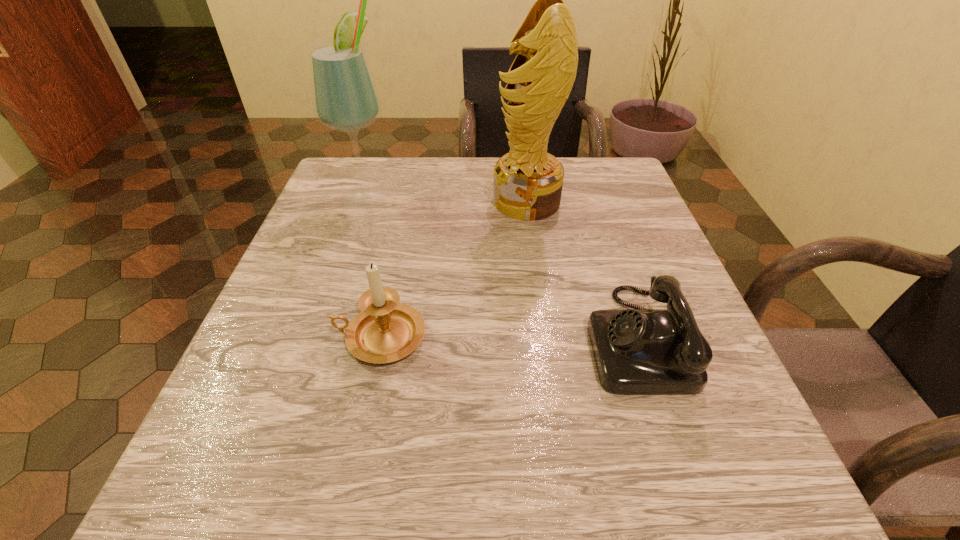
Identify the location of vacant space at the far edge. The image size is (960, 540). (444, 176).

Image resolution: width=960 pixels, height=540 pixels. In the image, there is a desktop. Identify the location of vacant space at the near edge. (443, 491).

At what (x,y) coordinates should I click in order to perform the action: click on free space at the left edge of the desktop. Please return your answer as a coordinate pair (x, y). The height and width of the screenshot is (540, 960). Looking at the image, I should click on (319, 299).

Locate an element on the screen. The height and width of the screenshot is (540, 960). vacant space at the right edge of the desktop is located at coordinates (761, 437).

Identify the location of blank space at the near left corner of the desktop. This screenshot has height=540, width=960. (270, 471).

The width and height of the screenshot is (960, 540). I want to click on free space at the far right corner of the desktop, so click(x=622, y=177).

Locate an element on the screen. This screenshot has width=960, height=540. free spot between the telephone and the award is located at coordinates (581, 270).

Locate an element on the screen. The height and width of the screenshot is (540, 960). unoccupied area between the candle holder and the award is located at coordinates (453, 269).

This screenshot has height=540, width=960. What are the coordinates of `unoccupied position between the candle holder and the shortest object` in the screenshot? It's located at (508, 338).

Find the location of `free area in between the award and the third tallest object`. free area in between the award and the third tallest object is located at coordinates (453, 269).